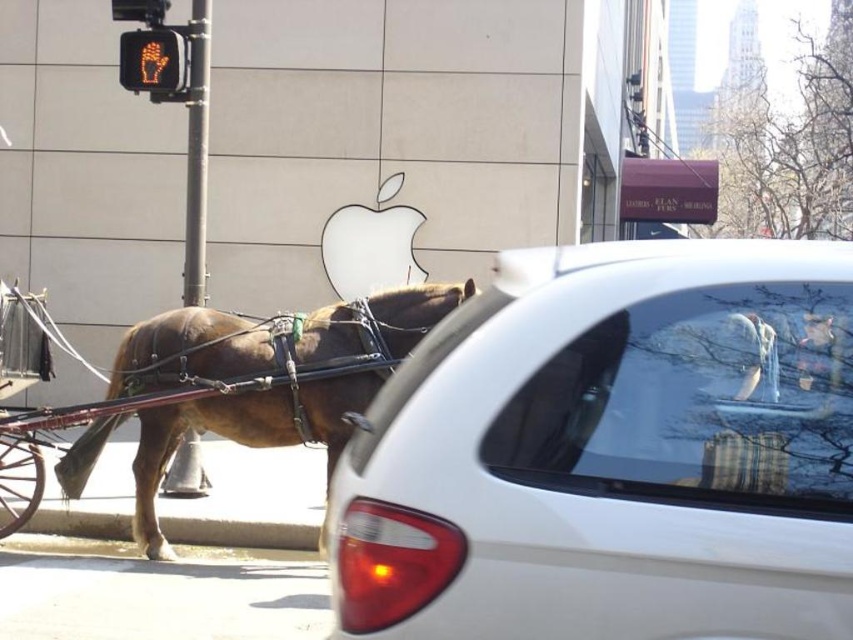
Which is behind, point (500, 529) or point (225, 429)?

Point (225, 429)

Is white glossy car at center positioned at the back of brown leather horse at left?

No.

Between point (621, 438) and point (164, 365), which one is positioned behind?

The point (164, 365) is more distant.

Find the location of a particular element. white glossy car at center is located at coordinates (612, 452).